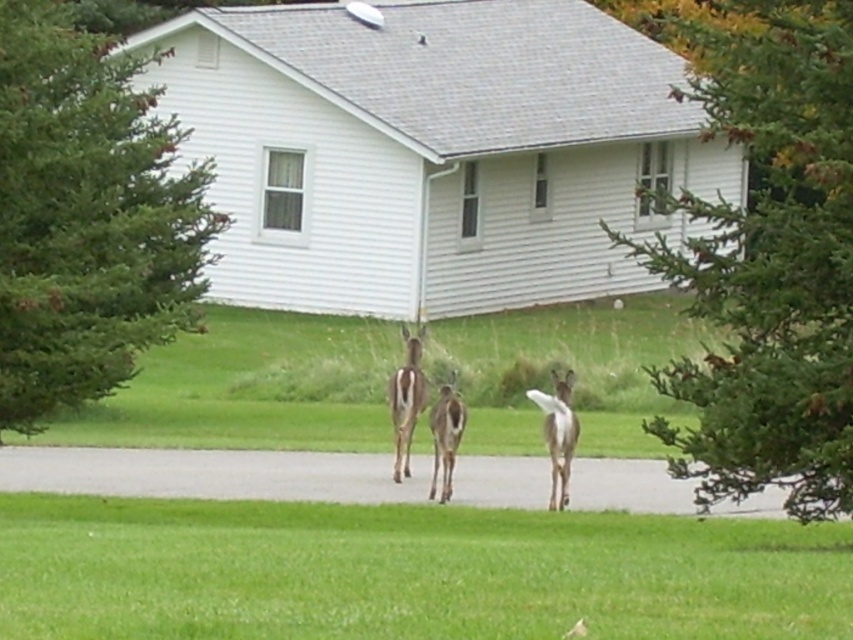
Question: Does green grass at lower center appear on the left side of brown fur deer at center?

Choices:
 (A) yes
 (B) no

Answer: (B)

Question: Is green grass at lower center smaller than white matte deer at center?

Choices:
 (A) no
 (B) yes

Answer: (A)

Question: Is green grass at lower center thinner than brown matte/deer at center?

Choices:
 (A) yes
 (B) no

Answer: (B)

Question: Which point is closer to the camera taking this photo?

Choices:
 (A) (149, 616)
 (B) (419, 346)
 (C) (552, 508)
 (D) (460, 406)

Answer: (A)

Question: Which object is closer to the camera taking this photo?

Choices:
 (A) white matte deer at center
 (B) green grass at lower center
 (C) brown matte/deer at center

Answer: (B)

Question: Estimate the real-world distances between objects in this image. Which object is farther from the green grass at lower center?

Choices:
 (A) white matte deer at center
 (B) brown fur deer at center

Answer: (B)